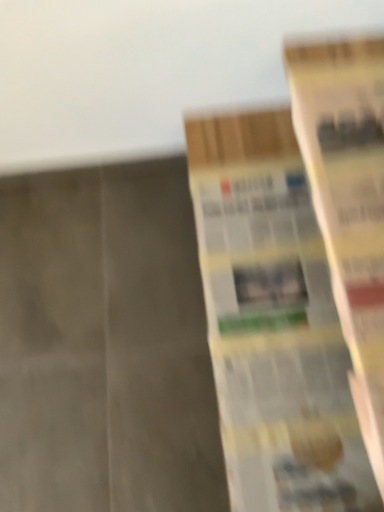
Question: Visually, is yellow paper book at right, which is the second book in right-to-left order, positioned to the left or to the right of yellow paper book at right, which ranks as the second book in left-to-right order?

Choices:
 (A) left
 (B) right

Answer: (A)

Question: Is yellow paper book at right, which is the second book in right-to-left order, taller or shorter than yellow paper book at right, which ranks as the second book in left-to-right order?

Choices:
 (A) tall
 (B) short

Answer: (A)

Question: Does point (309, 303) appear closer or farther from the camera than point (337, 237)?

Choices:
 (A) farther
 (B) closer

Answer: (A)

Question: Based on their positions, is yellow paper book at right, the 1th book when ordered from right to left, located to the left or right of yellow paper book at right, which is the second book in right-to-left order?

Choices:
 (A) right
 (B) left

Answer: (A)

Question: From their relative heights in the image, would you say yellow paper book at right, which ranks as the second book in left-to-right order, is taller or shorter than yellow paper book at right, which is the second book in right-to-left order?

Choices:
 (A) short
 (B) tall

Answer: (A)

Question: Considering the positions of yellow paper book at right, the 1th book when ordered from right to left, and yellow paper book at right, which is the second book in right-to-left order, in the image, is yellow paper book at right, the 1th book when ordered from right to left, wider or thinner than yellow paper book at right, which is the second book in right-to-left order,?

Choices:
 (A) thin
 (B) wide

Answer: (A)

Question: Is yellow paper book at right, which ranks as the second book in left-to-right order, bigger or smaller than yellow paper book at right, placed as the 1th book when sorted from left to right?

Choices:
 (A) small
 (B) big

Answer: (A)